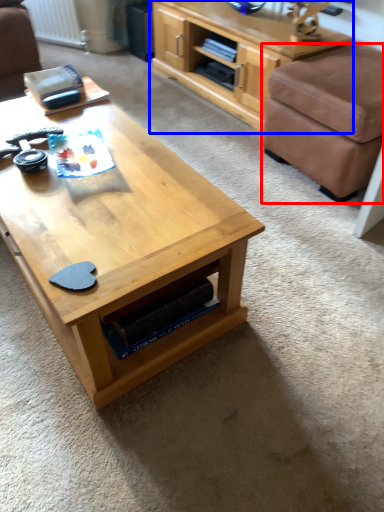
Question: Which object appears farthest to the camera in this image, stool (highlighted by a red box) or shelf (highlighted by a blue box)?

Choices:
 (A) stool
 (B) shelf

Answer: (B)